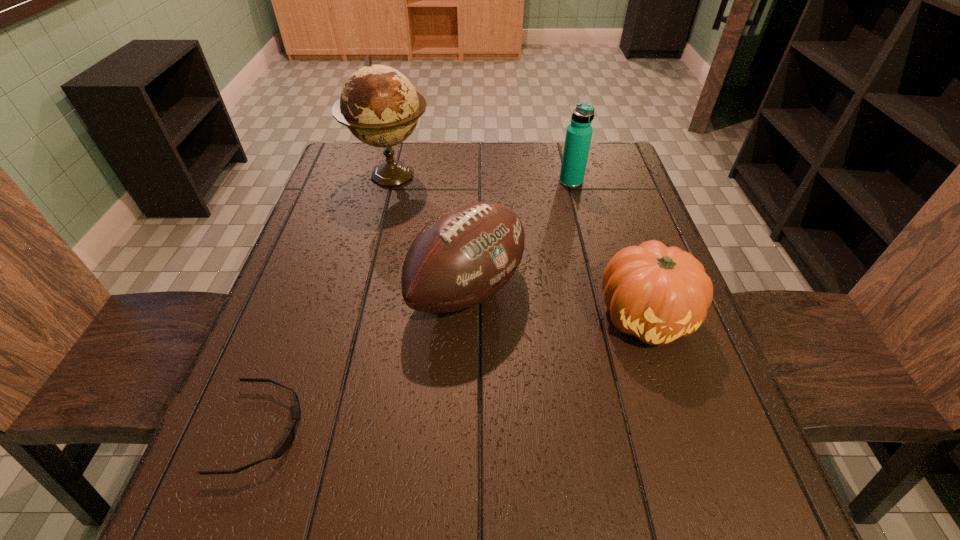
Find the location of `free space located on the front-facing side of the shortest object`. free space located on the front-facing side of the shortest object is located at coordinates click(497, 429).

Where is `globe present at the far edge`? Image resolution: width=960 pixels, height=540 pixels. globe present at the far edge is located at coordinates (379, 105).

Where is `water bottle present at the far edge`? The height and width of the screenshot is (540, 960). water bottle present at the far edge is located at coordinates (579, 132).

Locate an element on the screen. This screenshot has height=540, width=960. object that is at the near edge is located at coordinates (288, 440).

Locate an element on the screen. The height and width of the screenshot is (540, 960). globe that is positioned at the left edge is located at coordinates [379, 105].

This screenshot has width=960, height=540. Find the location of `sunglasses at the left edge`. sunglasses at the left edge is located at coordinates (288, 440).

The width and height of the screenshot is (960, 540). What are the coordinates of `water bottle at the right edge` in the screenshot? It's located at pyautogui.click(x=579, y=132).

At what (x,y) coordinates should I click in order to perform the action: click on pumpkin located in the right edge section of the desktop. Please return your answer as a coordinate pair (x, y). The image size is (960, 540). Looking at the image, I should click on (657, 293).

Locate an element on the screen. object located in the far left corner section of the desktop is located at coordinates (379, 105).

Find the location of a particular element. object that is at the near left corner is located at coordinates (288, 440).